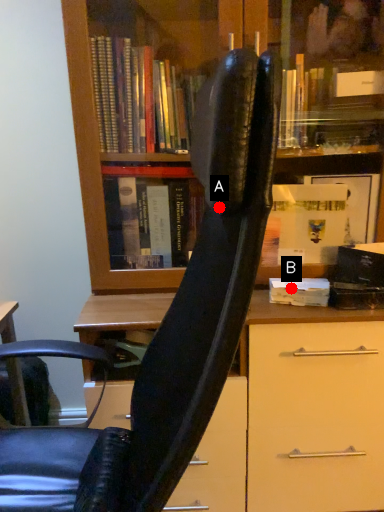
Question: Two points are circled on the image, labeled by A and B beside each circle. Among these points, which one is farthest from the camera?

Choices:
 (A) A is further
 (B) B is further

Answer: (B)